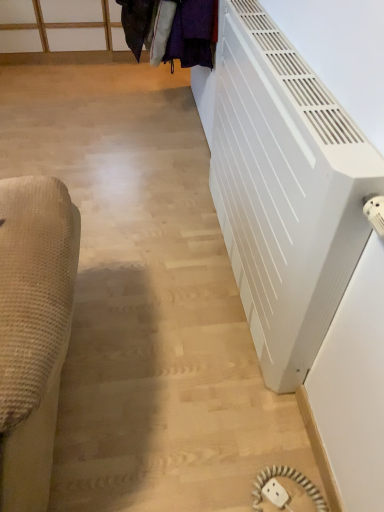
Identify the location of vacant space to the right of white plastic outlet at lower right. (309, 486).